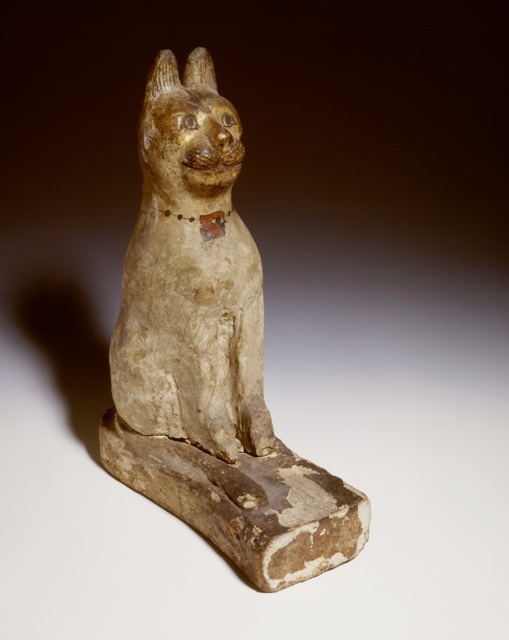
Is matte beige cat statue at center smaller than matte beige cat at center?

No.

Can you confirm if matte beige cat statue at center is shorter than matte beige cat at center?

Incorrect, matte beige cat statue at center's height does not fall short of matte beige cat at center's.

Is point (230, 241) closer to viewer compared to point (182, 168)?

That is False.

Find the location of a particular element. Image resolution: width=509 pixels, height=640 pixels. matte beige cat statue at center is located at coordinates (210, 355).